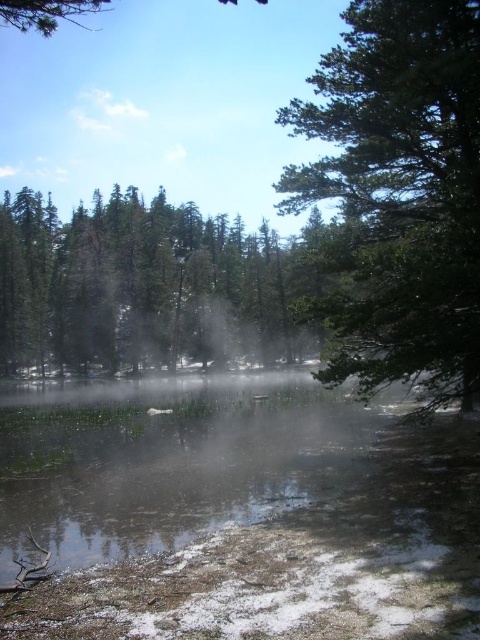
Find the location of `green textured tree at upper right`. green textured tree at upper right is located at coordinates (398, 192).